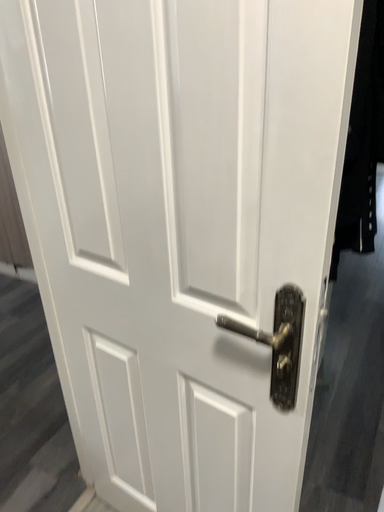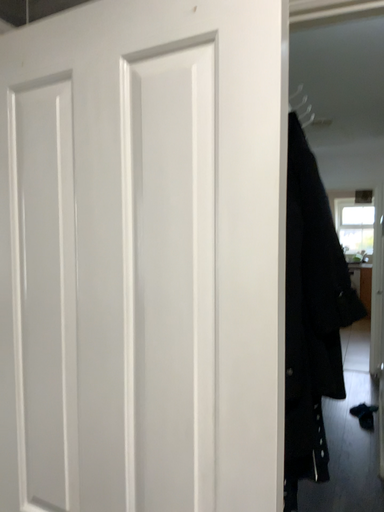
Question: How did the camera likely rotate when shooting the video?

Choices:
 (A) rotated upward
 (B) rotated downward

Answer: (A)